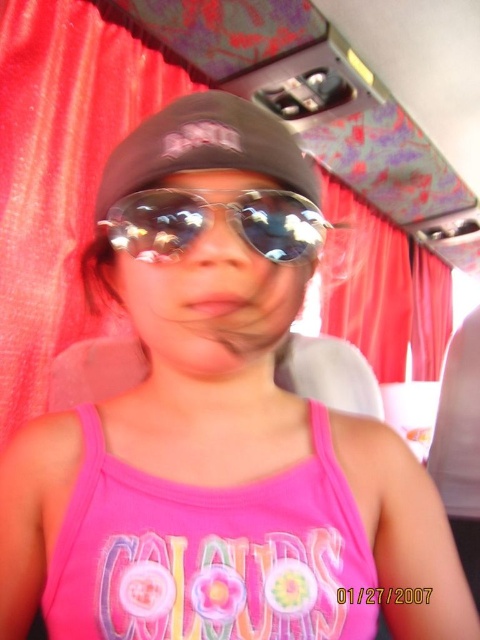
What do you see at coordinates (205, 147) in the screenshot?
I see `matte black baseball cap at center` at bounding box center [205, 147].

Consider the image. Who is lower down, matte black baseball cap at center or shiny reflective sunglasses at center?

Positioned lower is shiny reflective sunglasses at center.

The width and height of the screenshot is (480, 640). What are the coordinates of `matte black baseball cap at center` in the screenshot? It's located at (205, 147).

You are a GUI agent. You are given a task and a screenshot of the screen. Output one action in this format:
    pyautogui.click(x=<x>, y=<y>)
    Task: Click on the matte black baseball cap at center
    The height and width of the screenshot is (640, 480).
    Given the screenshot: What is the action you would take?
    pyautogui.click(x=205, y=147)